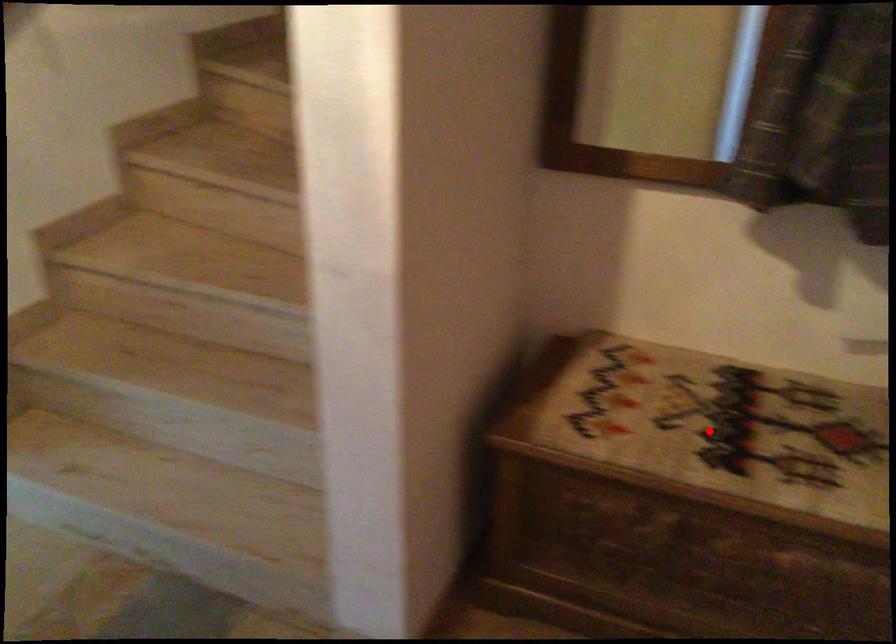
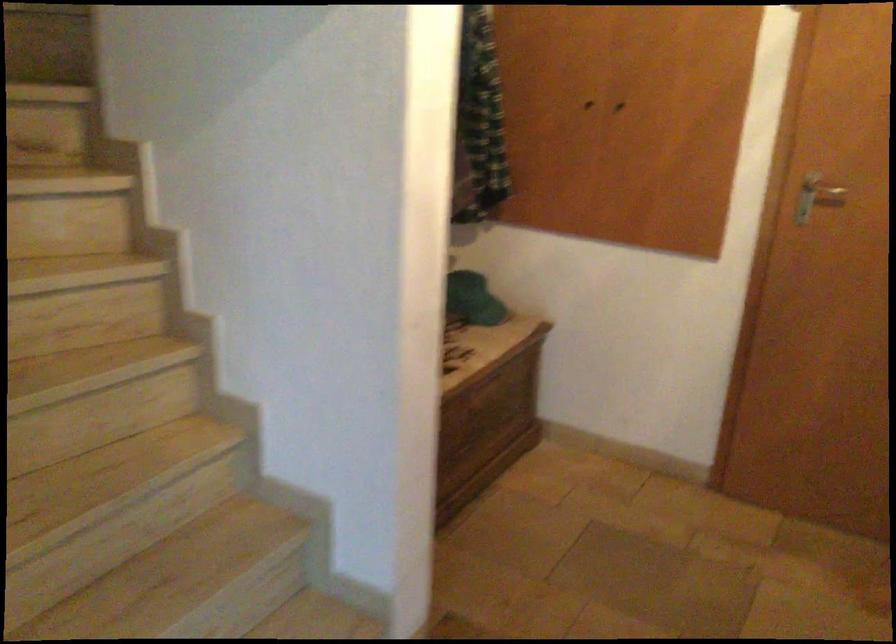
Question: I am providing you with two images of the same scene from different viewpoints. A red point is marked on the first image. At the location where the point appears in image 1, is it still visible in image 2?

Choices:
 (A) Yes
 (B) No

Answer: (B)